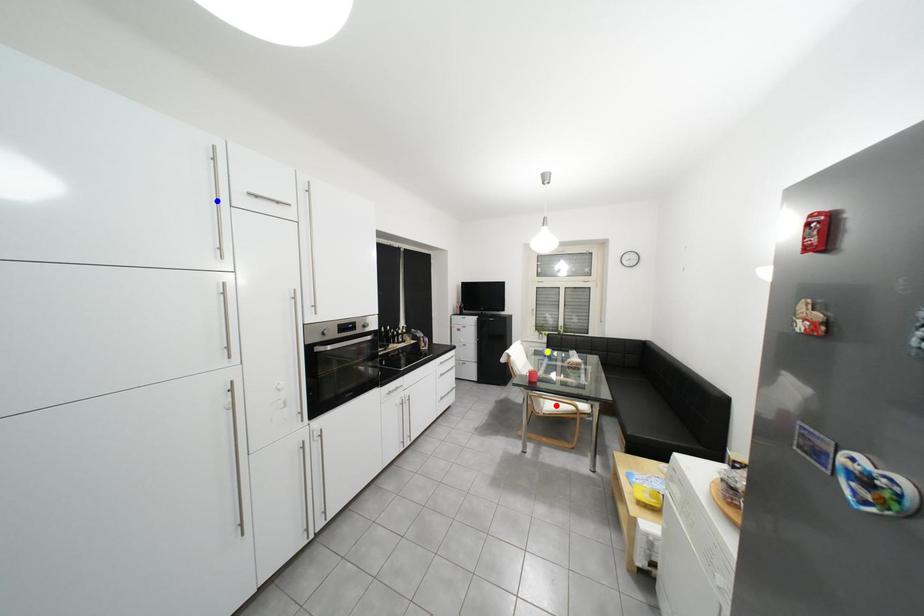
Order these from farthest to nearest:
A) blue point
B) yellow point
C) red point

1. yellow point
2. red point
3. blue point